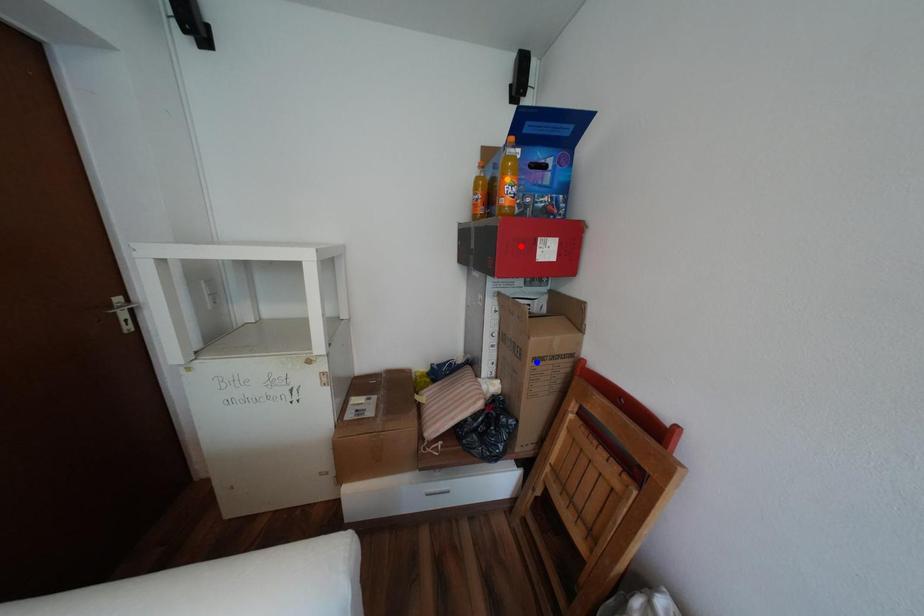
Order these from nearest to farthest:
red point, orange point, blue point

orange point → blue point → red point